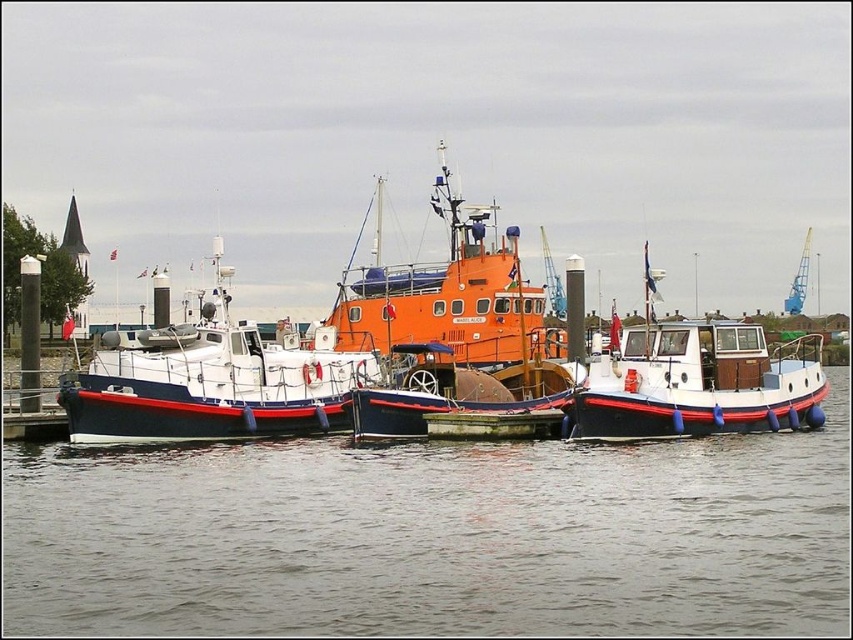
Looking at this image, is white matte boat at left below white matte boat at center?

Actually, white matte boat at left is above white matte boat at center.

Can you confirm if white matte boat at left is taller than white matte boat at center?

Indeed, white matte boat at left has a greater height compared to white matte boat at center.

The image size is (853, 640). Identify the location of white matte boat at left. (209, 384).

Does smooth water at center come in front of orange matte tugboat at center?

Yes, it is.

Who is more forward, [328,545] or [379,252]?

Point [328,545] is in front.

In order to click on smooth water at center in this screenshot , I will do `click(433, 536)`.

Does orange matte tugboat at center have a larger size compared to white matte boat at center?

Yes.

Is orange matte tugboat at center taller than white matte boat at center?

Yes, orange matte tugboat at center is taller than white matte boat at center.

Who is more distant from viewer, (x=462, y=353) or (x=589, y=424)?

The point (x=462, y=353) is more distant.

Where is `orange matte tugboat at center`? This screenshot has width=853, height=640. orange matte tugboat at center is located at coordinates (450, 328).